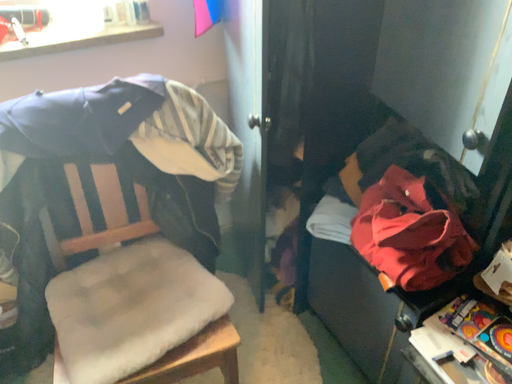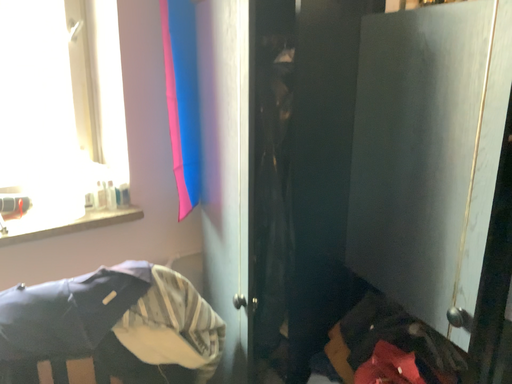
Question: How did the camera likely rotate when shooting the video?

Choices:
 (A) rotated upward
 (B) rotated downward

Answer: (A)